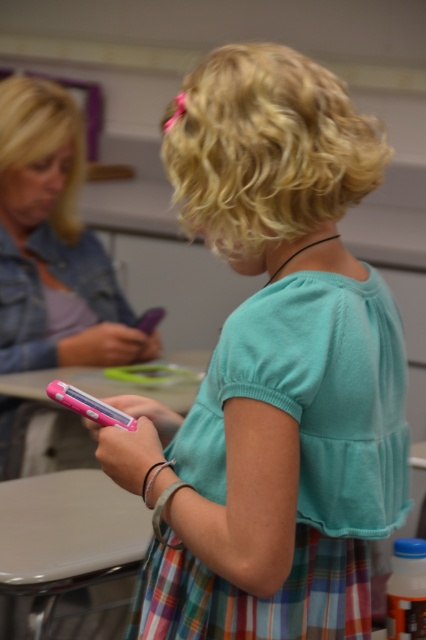
Looking at this image, can you confirm if matte teal shirt at center is thinner than matte pink phone at left?

Incorrect, matte teal shirt at center's width is not less than matte pink phone at left's.

Is point (310, 209) closer to camera compared to point (141, 358)?

Yes, point (310, 209) is closer to viewer.

Find the location of a particular element. matte teal shirt at center is located at coordinates (273, 371).